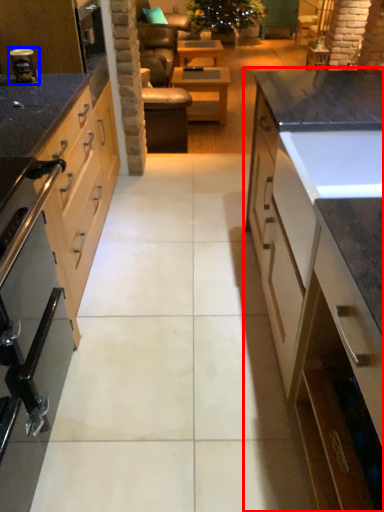
Question: Which object is further to the camera taking this photo, cabinetry (highlighted by a red box) or appliance (highlighted by a blue box)?

Choices:
 (A) cabinetry
 (B) appliance

Answer: (B)